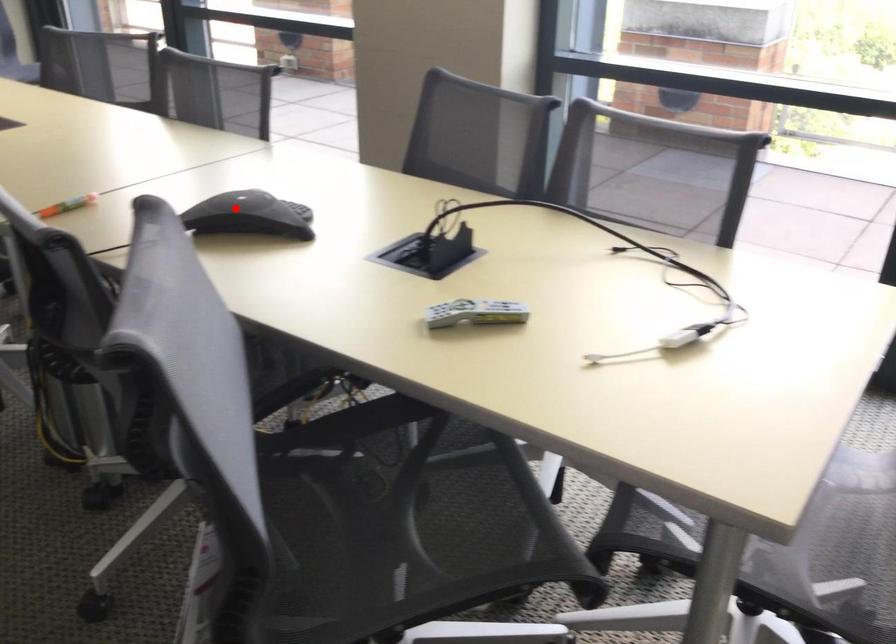
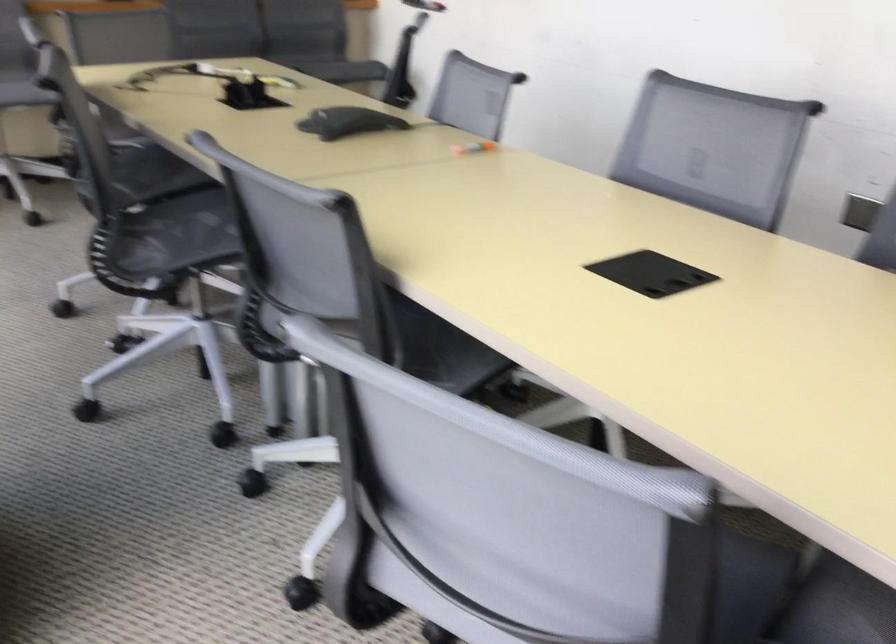
Find the pixel in the second image that matches the highlighted location in the first image.

(348, 122)